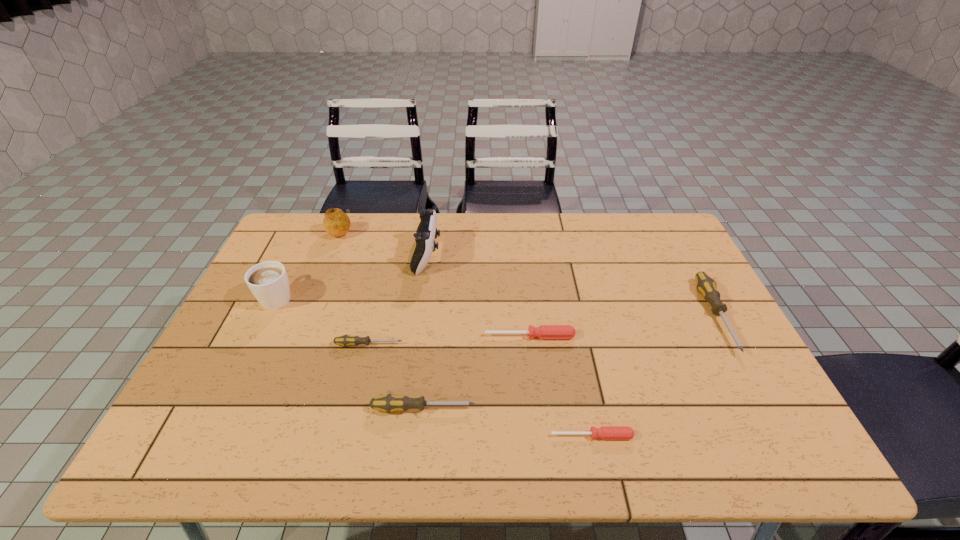
Where is `vacant space at the near edge of the desktop`? vacant space at the near edge of the desktop is located at coordinates (419, 443).

Locate an element on the screen. free region at the right edge of the desktop is located at coordinates (670, 268).

You are a GUI agent. You are given a task and a screenshot of the screen. Output one action in this format:
    pyautogui.click(x=<x>, y=<y>)
    Task: Click on the vacant region at the far right corner
    The image size is (960, 540).
    Given the screenshot: What is the action you would take?
    pyautogui.click(x=672, y=248)

In the image, there is a desktop. Identify the location of vacant region at the near right corner. (771, 450).

Image resolution: width=960 pixels, height=540 pixels. Find the location of `free space between the smallest gray screwdriver and the leftmost object`. free space between the smallest gray screwdriver and the leftmost object is located at coordinates (324, 321).

Image resolution: width=960 pixels, height=540 pixels. I want to click on free space between the smallest gray screwdriver and the bigger red screwdriver, so click(x=449, y=340).

Identify the location of vacant point located between the cappuccino and the bigger red screwdriver. (404, 316).

I want to click on vacant space in between the white cappuccino and the nearer red screwdriver, so click(x=435, y=366).

I want to click on free space between the seventh object from right to left and the smaller red screwdriver, so click(467, 333).

I want to click on free space between the leftmost object and the control, so click(x=352, y=276).